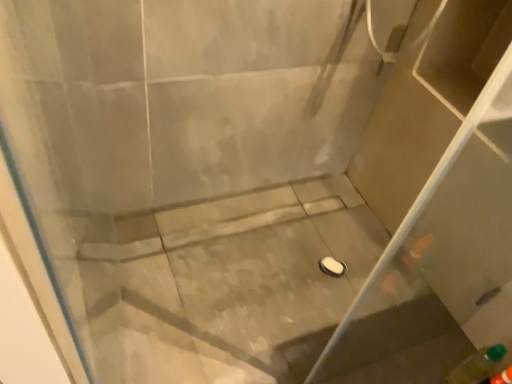
Where is `gray concrete at center`? This screenshot has height=384, width=512. gray concrete at center is located at coordinates (224, 283).

This screenshot has width=512, height=384. Describe the element at coordinates (224, 283) in the screenshot. I see `gray concrete at center` at that location.

At what (x,y) coordinates should I click in order to perform the action: click on gray concrete at center. Please return your answer as a coordinate pair (x, y). Looking at the image, I should click on (224, 283).